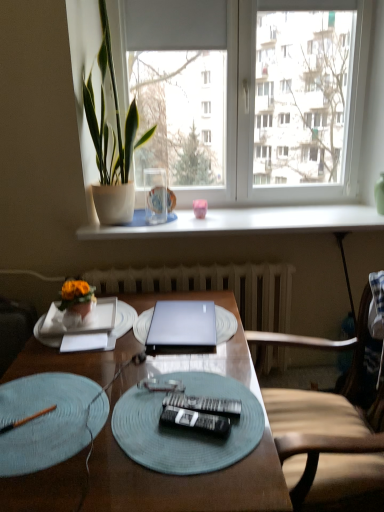
You are a GUI agent. You are given a task and a screenshot of the screen. Output one action in this format:
    pyautogui.click(x=<x>, y=<y>)
    Task: Click on the free space in front of silver metallic laptop at center
    
    Given the screenshot: What is the action you would take?
    pyautogui.click(x=188, y=371)